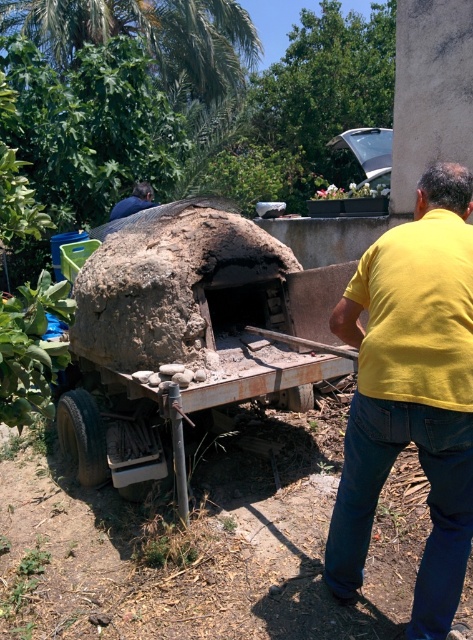
Question: Can you confirm if yellow cotton shirt at center is thinner than yellow matte shirt at upper right?

Choices:
 (A) yes
 (B) no

Answer: (B)

Question: Among these points, which one is farthest from the camera?

Choices:
 (A) [x=148, y=205]
 (B) [x=352, y=436]

Answer: (A)

Question: Where is yellow cotton shirt at center located in relation to yellow matte shirt at upper right in the image?

Choices:
 (A) below
 (B) above

Answer: (A)

Question: Is yellow cotton shirt at center smaller than yellow matte shirt at upper right?

Choices:
 (A) no
 (B) yes

Answer: (A)

Question: Among these objects, which one is nearest to the camera?

Choices:
 (A) yellow matte shirt at upper right
 (B) yellow cotton shirt at center

Answer: (B)

Question: Which point is closer to the camera?

Choices:
 (A) (437, 550)
 (B) (148, 196)

Answer: (A)